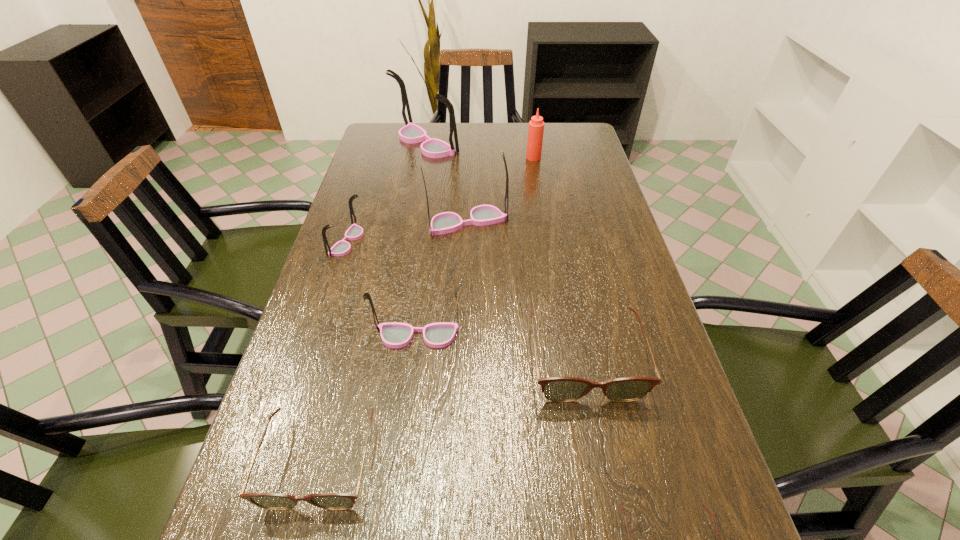
Find the location of a particular element. The image size is (960, 540). free space between the tallest object and the farthest brown spectacles is located at coordinates (505, 251).

You are a GUI agent. You are given a task and a screenshot of the screen. Output one action in this format:
    pyautogui.click(x=<x>, y=<y>)
    Task: Click on the empty space that is in between the third smallest pink spectacles and the smallest pink spectacles
    
    Given the screenshot: What is the action you would take?
    pyautogui.click(x=407, y=232)

At what (x,y) coordinates should I click in order to perform the action: click on free spot between the third shortest spectacles and the tallest object. Please return your answer as a coordinate pair (x, y). The width and height of the screenshot is (960, 540). Looking at the image, I should click on (505, 251).

Find the location of `object that ranks as the sixth closest to the third smallest pink spectacles`. object that ranks as the sixth closest to the third smallest pink spectacles is located at coordinates (274, 501).

Locate which object ranks seventh in proximity to the third smallest pink spectacles. Please provide its 2D coordinates. Your answer should be formatted as a tuple, i.e. [(x, y)], where the tuple contains the x and y coordinates of a point satisfying the conditions above.

[(703, 505)]

Identify which spectacles is the fourth closest to the leftmost pink spectacles. Please provide its 2D coordinates. Your answer should be formatted as a tuple, i.e. [(x, y)], where the tuple contains the x and y coordinates of a point satisfying the conditions above.

[(274, 501)]

Image resolution: width=960 pixels, height=540 pixels. Find the location of `spectacles that is the sixth closest one to the farthest brown spectacles`. spectacles that is the sixth closest one to the farthest brown spectacles is located at coordinates point(411,133).

Identify the location of pink spectacles that stands as the third closest to the sixth tallest object. (354, 232).

At what (x,y) coordinates should I click in order to perform the action: click on the second closest pink spectacles to the second farthest brown spectacles. Please return your answer as a coordinate pair (x, y). Looking at the image, I should click on (354, 232).

Choose which brown spectacles is the nearest neighbor to the third shortest spectacles. Please provide its 2D coordinates. Your answer should be formatted as a tuple, i.e. [(x, y)], where the tuple contains the x and y coordinates of a point satisfying the conditions above.

[(703, 505)]